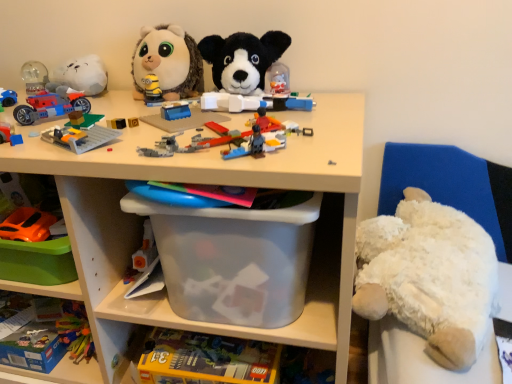
Question: Does transparent plastic container at center, acting as the 2th shelf starting from the bottom, have a greater height compared to matte plastic car at left, which is the fifth toy from top to bottom?

Choices:
 (A) yes
 (B) no

Answer: (A)

Question: Is transparent plastic container at center, acting as the 2th shelf starting from the bottom, outside of matte plastic car at left, which is the fifth toy from top to bottom?

Choices:
 (A) yes
 (B) no

Answer: (A)

Question: Is transparent plastic container at center, positioned as the first shelf in top-to-bottom order, turned away from matte plastic car at left, the third toy in the bottom-to-top sequence?

Choices:
 (A) yes
 (B) no

Answer: (B)

Question: Is transparent plastic container at center, acting as the 2th shelf starting from the bottom, to the left of matte plastic car at left, which is the fifth toy from top to bottom, from the viewer's perspective?

Choices:
 (A) yes
 (B) no

Answer: (B)

Question: Is transparent plastic container at center, acting as the 2th shelf starting from the bottom, positioned in front of matte plastic car at left, which is the fifth toy from top to bottom?

Choices:
 (A) no
 (B) yes

Answer: (B)

Question: Does point (242, 36) appear closer or farther from the camera than point (188, 82)?

Choices:
 (A) closer
 (B) farther

Answer: (A)

Question: Relative to fluffy white plush at upper center, which is counted as the seventh toy, starting from the bottom, is black plush dog at center, the 2th toy from the top, in front or behind?

Choices:
 (A) behind
 (B) front

Answer: (B)

Question: From a real-world perspective, is black plush dog at center, which is the 6th toy in bottom-to-top order, above or below fluffy white plush at upper center, the 1th toy from the top?

Choices:
 (A) above
 (B) below

Answer: (A)

Question: Is black plush dog at center, which is the 6th toy in bottom-to-top order, situated inside fluffy white plush at upper center, which is counted as the seventh toy, starting from the bottom, or outside?

Choices:
 (A) outside
 (B) inside

Answer: (A)

Question: Is white fluffy teddy bear at right in front of or behind transparent plastic storage box at lower center, the first storage box ordered from the bottom, in the image?

Choices:
 (A) behind
 (B) front

Answer: (B)

Question: In terms of size, does white fluffy teddy bear at right appear bigger or smaller than transparent plastic storage box at lower center, arranged as the 2th storage box when viewed from the top?

Choices:
 (A) small
 (B) big

Answer: (B)

Question: Which is correct: white fluffy teddy bear at right is inside transparent plastic storage box at lower center, arranged as the 2th storage box when viewed from the top, or outside of it?

Choices:
 (A) outside
 (B) inside

Answer: (A)

Question: From the image's perspective, is white fluffy teddy bear at right located above or below transparent plastic storage box at lower center, arranged as the 2th storage box when viewed from the top?

Choices:
 (A) below
 (B) above

Answer: (B)

Question: From a real-world perspective, is matte plastic car at left, the third toy in the bottom-to-top sequence, positioned above or below shiny plastic motorcycle at left, which is counted as the fifth toy, starting from the bottom?

Choices:
 (A) above
 (B) below

Answer: (B)

Question: In the image, is matte plastic car at left, which is the fifth toy from top to bottom, positioned in front of or behind shiny plastic motorcycle at left, which is counted as the fifth toy, starting from the bottom?

Choices:
 (A) front
 (B) behind

Answer: (A)